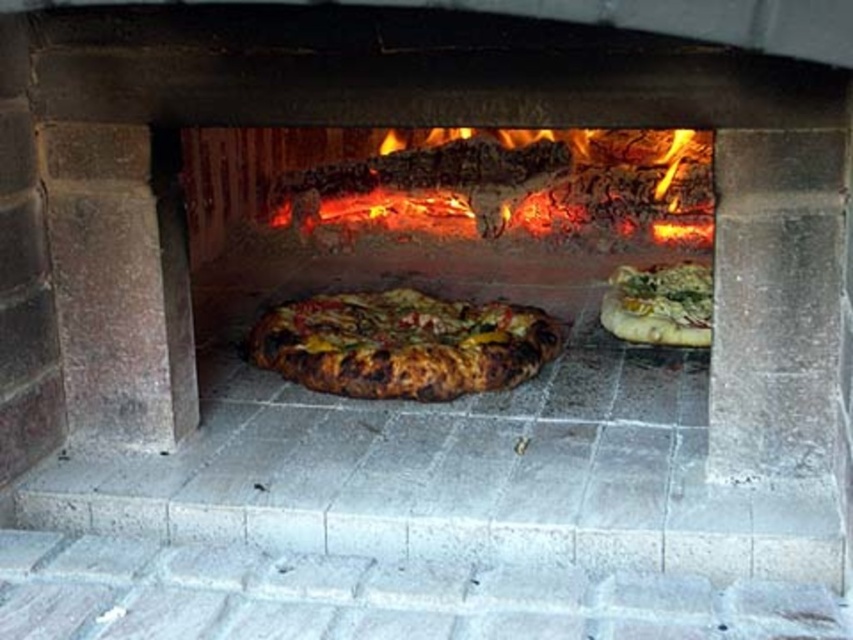
Question: Does charcoal-like wood at center have a lesser width compared to golden-brown crusty pizza at center?

Choices:
 (A) yes
 (B) no

Answer: (B)

Question: Can you confirm if charcoal-like wood at center is thinner than golden-brown crusty pizza at right?

Choices:
 (A) yes
 (B) no

Answer: (B)

Question: Can you confirm if charcoal-like wood at center is thinner than golden-brown crusty pizza at center?

Choices:
 (A) no
 (B) yes

Answer: (A)

Question: Which of the following is the farthest from the observer?

Choices:
 (A) (664, 339)
 (B) (306, 308)

Answer: (B)

Question: Which point is farther from the camera taking this photo?

Choices:
 (A) (685, 276)
 (B) (700, 184)
 (C) (523, 307)

Answer: (B)

Question: Which object is positioned farthest from the golden-brown crusty pizza at right?

Choices:
 (A) charcoal-like wood at center
 (B) golden-brown crusty pizza at center

Answer: (A)